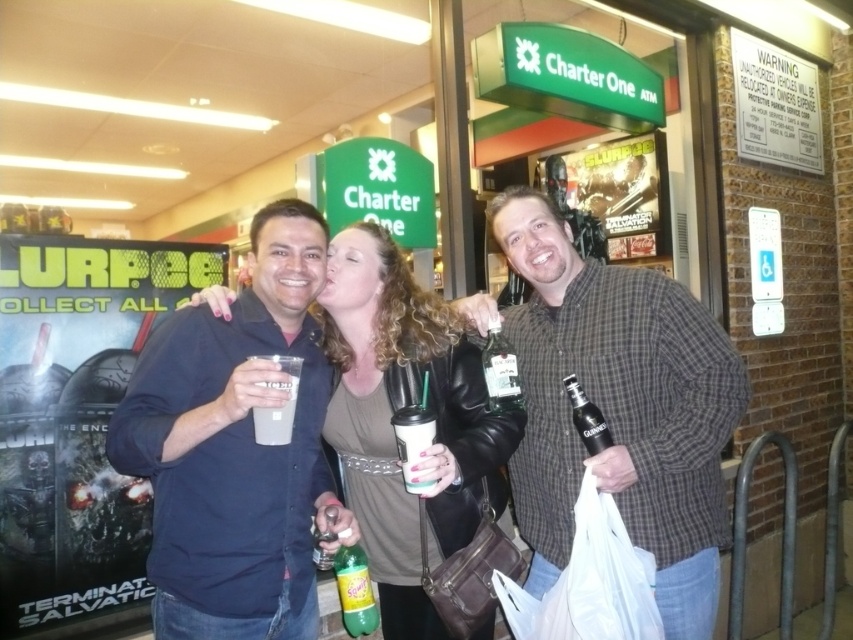
You are at a convenience store and see two items, a dark blue shirt at center and a white matte cup at center. Which item is positioned more to the left?

The dark blue shirt at center is positioned more to the left than the white matte cup at center.

You are a photographer trying to capture a clear photo of the dark blue shirt at center and the white matte cup at center. Which object should you focus on first if you want to ensure both are in focus?

The dark blue shirt at center has a greater height compared to the white matte cup at center, so you should focus on the dark blue shirt at center first to ensure both are in focus.